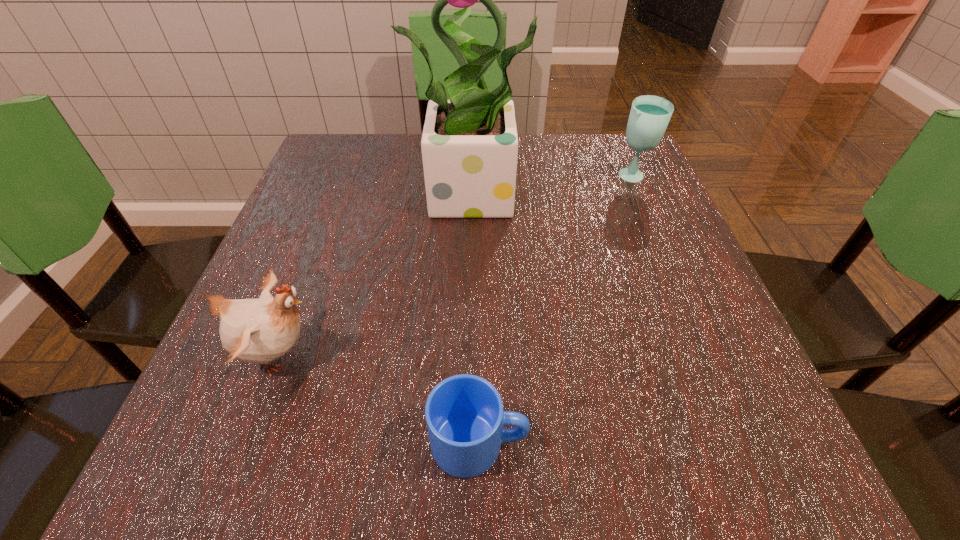
Locate an element on the screen. The height and width of the screenshot is (540, 960). vacant area that lies between the rightmost object and the shortest object is located at coordinates (556, 310).

This screenshot has height=540, width=960. What are the coordinates of `free point between the tallest object and the glass` in the screenshot? It's located at (557, 185).

Find the location of `vacant area between the shortest object and the leftmost object`. vacant area between the shortest object and the leftmost object is located at coordinates (380, 399).

This screenshot has width=960, height=540. Find the location of `free space between the rightmost object and the bird`. free space between the rightmost object and the bird is located at coordinates (457, 266).

The image size is (960, 540). I want to click on vacant space that's between the glass and the bird, so click(457, 266).

Find the location of a particular element. The height and width of the screenshot is (540, 960). vacant space in between the flower arrangement and the mug is located at coordinates tap(480, 317).

This screenshot has height=540, width=960. Identify the location of free space between the bird and the glass. (457, 266).

At what (x,y) coordinates should I click in order to perform the action: click on free area in between the tallest object and the rightmost object. Please return your answer as a coordinate pair (x, y). Looking at the image, I should click on (557, 185).

I want to click on free space that is in between the mug and the bird, so click(380, 399).

This screenshot has width=960, height=540. I want to click on free point between the shortest object and the bird, so click(380, 399).